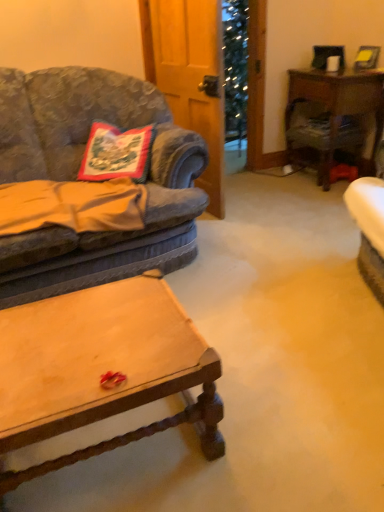
Where is `free location to the left of wooden desk at right`? free location to the left of wooden desk at right is located at coordinates (268, 184).